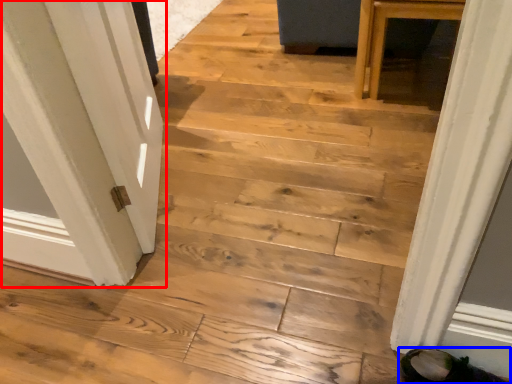
Question: Which object appears closest to the camera in this image, door (highlighted by a red box) or footwear (highlighted by a blue box)?

Choices:
 (A) door
 (B) footwear

Answer: (B)